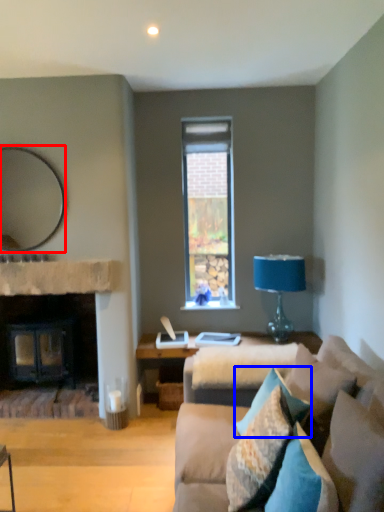
Question: Which object is closer to the camera taking this photo, mirror (highlighted by a red box) or pillow (highlighted by a blue box)?

Choices:
 (A) mirror
 (B) pillow

Answer: (B)